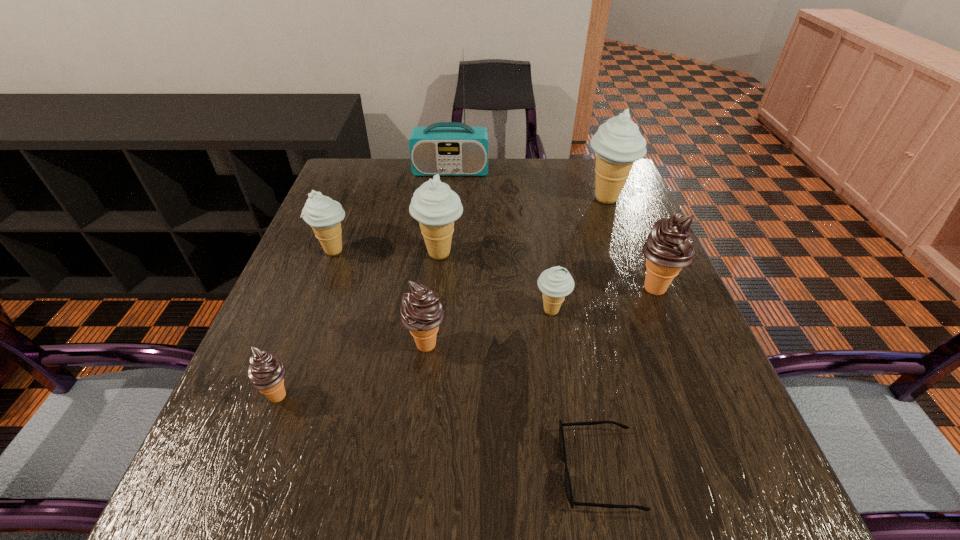
Find the location of a particular element. object located in the far right corner section of the desktop is located at coordinates (618, 143).

Locate an element on the screen. This screenshot has height=540, width=960. vacant space at the far edge of the desktop is located at coordinates (399, 172).

The image size is (960, 540). I want to click on free space at the near edge, so click(x=335, y=521).

Identify the location of vacant space at the left edge of the desktop. (287, 468).

At what (x,y) coordinates should I click in order to perform the action: click on blank space at the right edge of the desktop. Please return your answer as a coordinate pair (x, y). Looking at the image, I should click on (693, 470).

Identify the location of blank space at the far left corner. (349, 201).

Image resolution: width=960 pixels, height=540 pixels. Find the location of `vacant space at the far right corner`. vacant space at the far right corner is located at coordinates (588, 164).

Image resolution: width=960 pixels, height=540 pixels. Find the location of `vacant space in between the second farthest chocolate icecream and the farthest icecream`. vacant space in between the second farthest chocolate icecream and the farthest icecream is located at coordinates (516, 271).

You are a GUI agent. You are given a task and a screenshot of the screen. Output one action in this format:
    pyautogui.click(x=<x>, y=<y>)
    Task: Click on the unoccupied area between the rightmost chocolate icecream and the tallest icecream
    The image size is (960, 540).
    Given the screenshot: What is the action you would take?
    pyautogui.click(x=631, y=244)

Where is `vacant region between the third icecream from right to left and the farthest chocolate icecream`? vacant region between the third icecream from right to left and the farthest chocolate icecream is located at coordinates (603, 300).